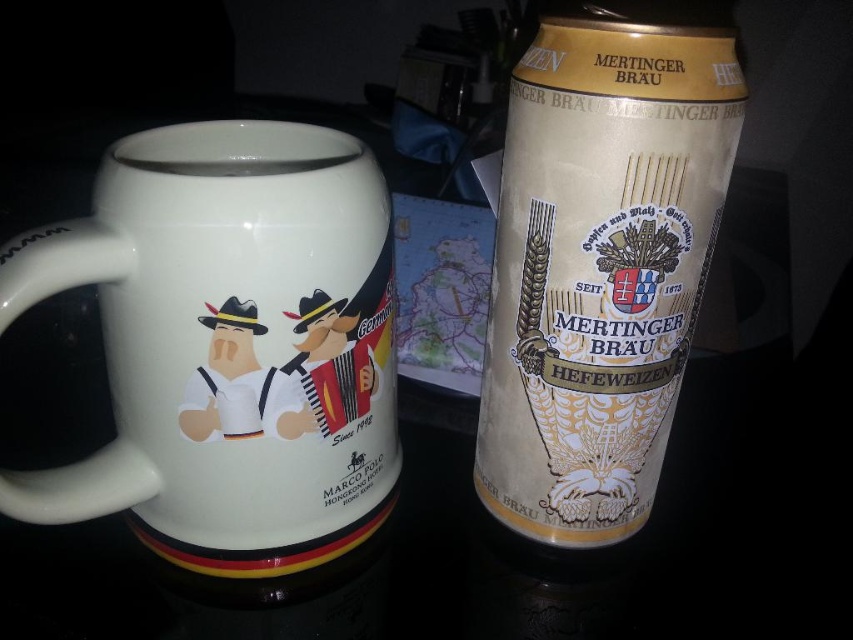
Question: Among these objects, which one is nearest to the camera?

Choices:
 (A) gold matte beer can at right
 (B) white ceramic mug at left

Answer: (A)

Question: Is white ceramic mug at left further to camera compared to gold matte beer can at right?

Choices:
 (A) yes
 (B) no

Answer: (A)

Question: Which point appears closest to the camera in this image?

Choices:
 (A) (514, 340)
 (B) (229, 216)

Answer: (B)

Question: Which point is closer to the camera?

Choices:
 (A) (117, 208)
 (B) (508, 420)

Answer: (A)

Question: Is white ceramic mug at left smaller than gold matte beer can at right?

Choices:
 (A) yes
 (B) no

Answer: (B)

Question: From the image, what is the correct spatial relationship of white ceramic mug at left in relation to gold matte beer can at right?

Choices:
 (A) below
 (B) above

Answer: (A)